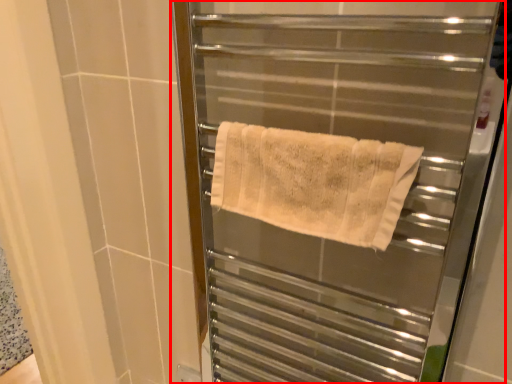
Question: Where is screen door (annotated by the red box) located in relation to towel in the image?

Choices:
 (A) right
 (B) left

Answer: (A)